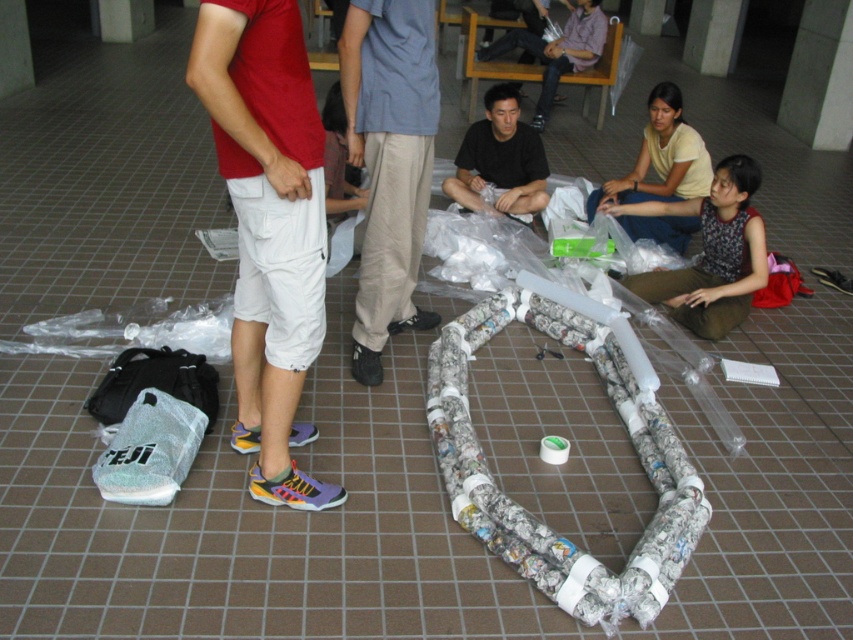
Question: Does beige cotton pants at center have a lesser width compared to light yellow cotton shirt at upper right?

Choices:
 (A) yes
 (B) no

Answer: (A)

Question: In this image, where is beige cotton pants at center located relative to black matte shirt at center?

Choices:
 (A) left
 (B) right

Answer: (A)

Question: Does white cotton shorts at center appear over light yellow cotton shirt at upper right?

Choices:
 (A) no
 (B) yes

Answer: (A)

Question: Which object is closer to the camera taking this photo?

Choices:
 (A) black matte shirt at center
 (B) beige cotton pants at center
 (C) patterned fabric shirt at lower right

Answer: (B)

Question: Which object is farther from the camera taking this photo?

Choices:
 (A) black matte shirt at center
 (B) beige cotton pants at center
 (C) patterned fabric shirt at lower right
 (D) white cotton shorts at center

Answer: (A)

Question: Which of these objects is positioned farthest from the patterned fabric shirt at lower right?

Choices:
 (A) beige cotton pants at center
 (B) white cotton shorts at center

Answer: (B)